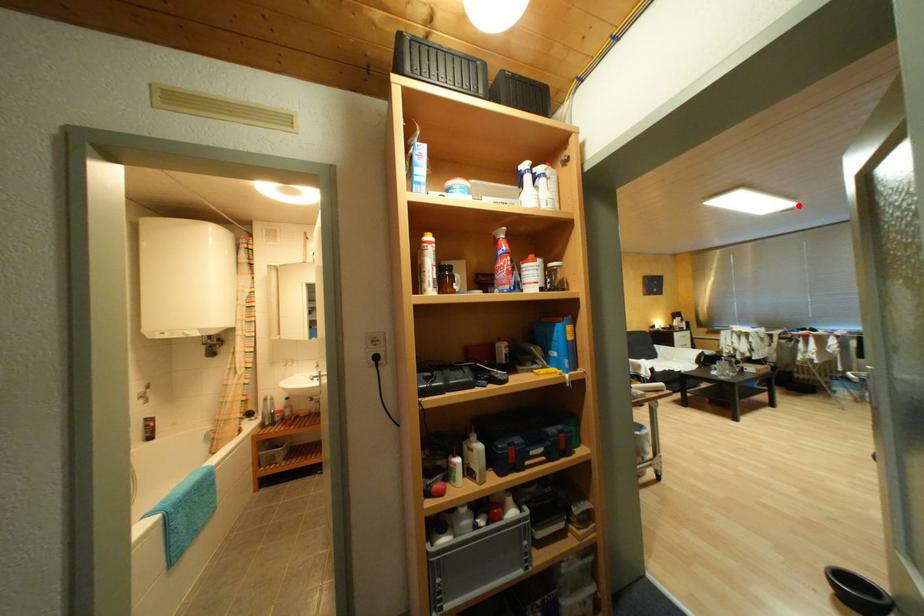
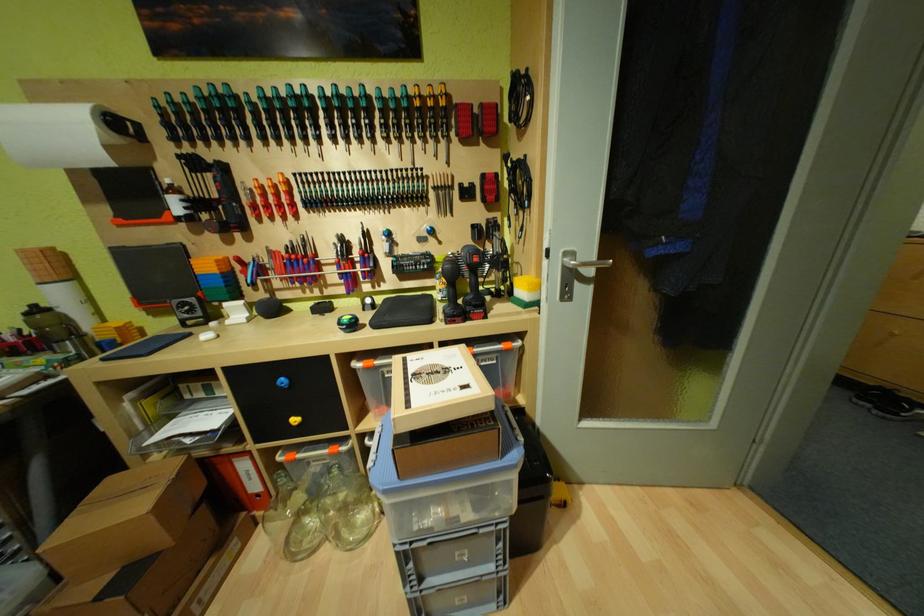
Question: I am providing you with two images of the same scene from different viewpoints. A red point is marked on the first image. At the location where the point appears in image 1, is it still visible in image 2?

Choices:
 (A) Yes
 (B) No

Answer: (B)